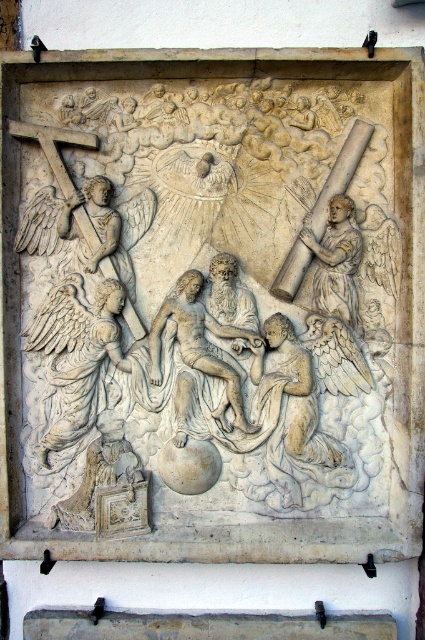
Question: Does white stone sculpture at center appear under smooth stone angel at right?

Choices:
 (A) yes
 (B) no

Answer: (A)

Question: Can you confirm if white stone sculpture at center is positioned above smooth stone angel at right?

Choices:
 (A) no
 (B) yes

Answer: (A)

Question: Which object is farther from the camera taking this photo?

Choices:
 (A) white stone sculpture at center
 (B) smooth stone angel at right

Answer: (B)

Question: Does white stone sculpture at center appear over smooth stone angel at right?

Choices:
 (A) yes
 (B) no

Answer: (B)

Question: Which point is farther to the camera?

Choices:
 (A) white stone sculpture at center
 (B) smooth stone angel at right

Answer: (B)

Question: Which of the following is the closest to the observer?

Choices:
 (A) smooth stone angel at right
 (B) white stone sculpture at center

Answer: (B)